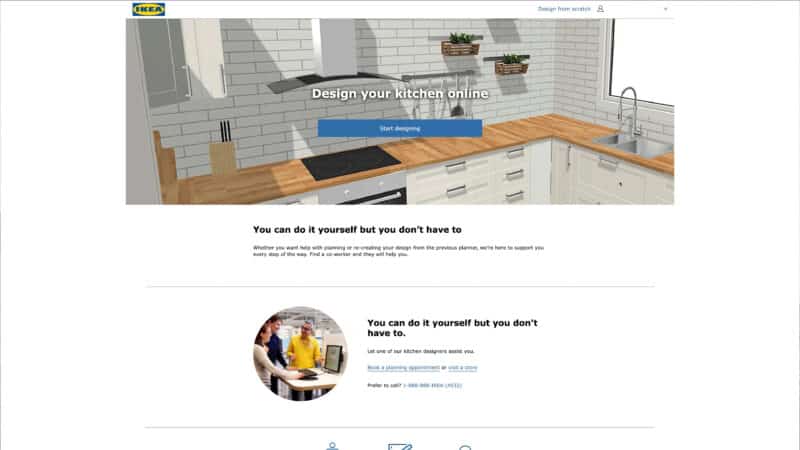
Where is `plant baskets`? This screenshot has width=800, height=450. plant baskets is located at coordinates (700, 265), (460, 52), (514, 70).